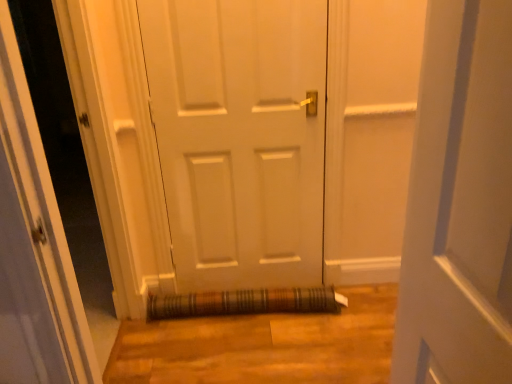
What do you see at coordinates (245, 302) in the screenshot? The image size is (512, 384). I see `brown woven mat at lower center` at bounding box center [245, 302].

The image size is (512, 384). What do you see at coordinates (45, 250) in the screenshot?
I see `transparent glass door at center` at bounding box center [45, 250].

What is the approximate width of transparent glass door at center?

transparent glass door at center is 5.72 inches wide.

What do you see at coordinates (239, 137) in the screenshot? This screenshot has width=512, height=384. I see `white matte door at center` at bounding box center [239, 137].

You are a GUI agent. You are given a task and a screenshot of the screen. Output one action in this format:
    pyautogui.click(x=<x>, y=<y>)
    Task: Click on the white matte door at center
    
    Given the screenshot: What is the action you would take?
    pyautogui.click(x=239, y=137)

This screenshot has height=384, width=512. Find the location of `brown woven mat at lower center`. brown woven mat at lower center is located at coordinates (245, 302).

Is white matte door at center completely or partially outside of brown woven mat at lower center?

Yes, white matte door at center is located beyond the bounds of brown woven mat at lower center.

Is point (318, 72) less distant than point (217, 306)?

Yes, it is in front of point (217, 306).

Is white matte door at center to the right of brown woven mat at lower center from the viewer's perspective?

Incorrect, white matte door at center is not on the right side of brown woven mat at lower center.

Can you confirm if white matte door at center is taller than brown woven mat at lower center?

Yes, white matte door at center is taller than brown woven mat at lower center.

Is transparent glass door at center to the right of white matte door at center from the viewer's perspective?

No, transparent glass door at center is not to the right of white matte door at center.

Considering the sizes of objects transparent glass door at center and white matte door at center in the image provided, who is bigger, transparent glass door at center or white matte door at center?

With larger size is transparent glass door at center.

Is point (34, 288) less distant than point (268, 192)?

That is True.

Considering the sizes of objects transparent glass door at center and white matte door at center in the image provided, who is wider, transparent glass door at center or white matte door at center?

transparent glass door at center is wider.

Does white matte door at center turn towards transparent glass door at center?

No, white matte door at center is not aimed at transparent glass door at center.

Considering the sizes of objects white matte door at center and transparent glass door at center in the image provided, who is taller, white matte door at center or transparent glass door at center?

Standing taller between the two is white matte door at center.

In terms of width, does white matte door at center look wider or thinner when compared to transparent glass door at center?

Clearly, white matte door at center has less width compared to transparent glass door at center.

Consider the image. Is white matte door at center positioned far away from transparent glass door at center?

Absolutely, white matte door at center is distant from transparent glass door at center.

Considering the relative sizes of transparent glass door at center and brown woven mat at lower center in the image provided, is transparent glass door at center thinner than brown woven mat at lower center?

Incorrect, the width of transparent glass door at center is not less than that of brown woven mat at lower center.

From a real-world perspective, is transparent glass door at center positioned over brown woven mat at lower center based on gravity?

Yes, from a real-world perspective, transparent glass door at center is over brown woven mat at lower center

Is point (33, 288) positioned in front of point (194, 306)?

Yes, it is.

Can brown woven mat at lower center be found inside transparent glass door at center?

No, brown woven mat at lower center is not surrounded by transparent glass door at center.

Which is correct: brown woven mat at lower center is inside transparent glass door at center, or outside of it?

brown woven mat at lower center is spatially situated outside transparent glass door at center.

Which is closer, (184, 298) or (97, 330)?

Point (97, 330)

Image resolution: width=512 pixels, height=384 pixels. I want to click on glass door lying above the brown woven mat at lower center (from the image's perspective), so click(x=45, y=250).

In terms of width, does brown woven mat at lower center look wider or thinner when compared to transparent glass door at center?

In the image, brown woven mat at lower center appears to be more narrow than transparent glass door at center.

Is point (191, 294) more distant than point (256, 140)?

Yes, point (191, 294) is farther from viewer.

From a real-world perspective, is brown woven mat at lower center positioned under white matte door at center based on gravity?

Yes, from a real-world perspective, brown woven mat at lower center is beneath white matte door at center.

Consider the image. Does brown woven mat at lower center have a larger size compared to white matte door at center?

Incorrect, brown woven mat at lower center is not larger than white matte door at center.

Is brown woven mat at lower center to the right of white matte door at center from the viewer's perspective?

Indeed, brown woven mat at lower center is positioned on the right side of white matte door at center.

This screenshot has height=384, width=512. Find the location of `doormat below the white matte door at center (from the image's perspective)`. doormat below the white matte door at center (from the image's perspective) is located at coordinates (245, 302).

Identify the location of door that is on the right side of transparent glass door at center. (239, 137).

When comparing their distances from transparent glass door at center, does white matte door at center or brown woven mat at lower center seem closer?

brown woven mat at lower center.

Looking at the image, which one is located closer to white matte door at center, brown woven mat at lower center or transparent glass door at center?

brown woven mat at lower center.

In the scene shown: Based on their spatial positions, is transparent glass door at center or white matte door at center further from brown woven mat at lower center?

The object further to brown woven mat at lower center is transparent glass door at center.

Based on the photo, considering their positions, is transparent glass door at center positioned further to white matte door at center than brown woven mat at lower center?

Based on the image, transparent glass door at center appears to be further to white matte door at center.

Looking at the image, which one is located further to brown woven mat at lower center, white matte door at center or transparent glass door at center?

Based on the image, transparent glass door at center appears to be further to brown woven mat at lower center.

Based on their spatial positions, is brown woven mat at lower center or white matte door at center further from transparent glass door at center?

Based on the image, white matte door at center appears to be further to transparent glass door at center.

At what (x,y) coordinates should I click in order to perform the action: click on door located between transparent glass door at center and brown woven mat at lower center in the depth direction. Please return your answer as a coordinate pair (x, y). Image resolution: width=512 pixels, height=384 pixels. Looking at the image, I should click on (239, 137).